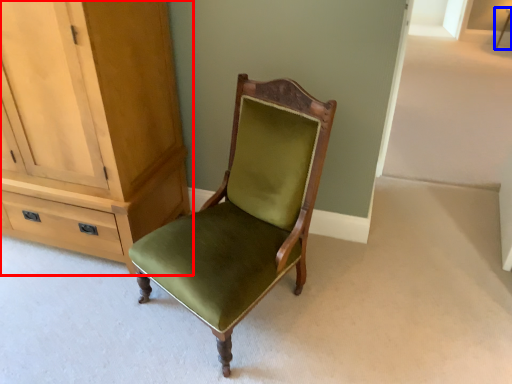
Question: Among these objects, which one is farthest to the camera, cabinetry (highlighted by a red box) or side table (highlighted by a blue box)?

Choices:
 (A) cabinetry
 (B) side table

Answer: (B)